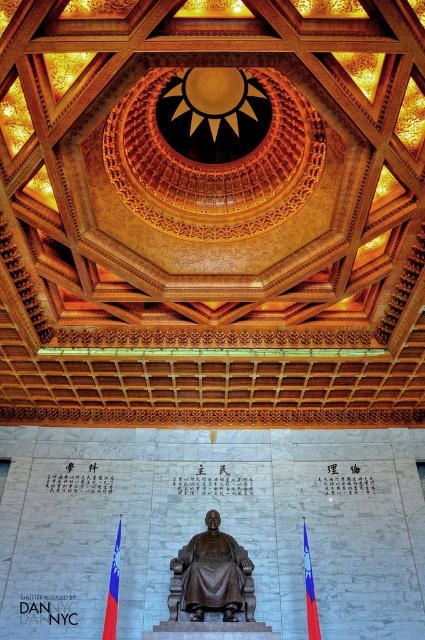
Question: Can you confirm if bronze statue at center is thinner than red fabric flag at lower left?

Choices:
 (A) no
 (B) yes

Answer: (A)

Question: Does bronze statue at center appear under red fabric flag at lower left?

Choices:
 (A) no
 (B) yes

Answer: (A)

Question: Which of the following is the closest to the observer?

Choices:
 (A) (212, 580)
 (B) (314, 628)

Answer: (B)

Question: Can you confirm if bronze statue at center is positioned below red fabric flag at lower left?

Choices:
 (A) no
 (B) yes

Answer: (A)

Question: Which point is closer to the camera taking this photo?

Choices:
 (A) (303, 545)
 (B) (226, 605)
 (C) (107, 625)

Answer: (C)

Question: Which of the following is the farthest from the observer?

Choices:
 (A) red fabric flag at lower left
 (B) bronze statue at center
 (C) blue-red striped flag at lower right

Answer: (B)